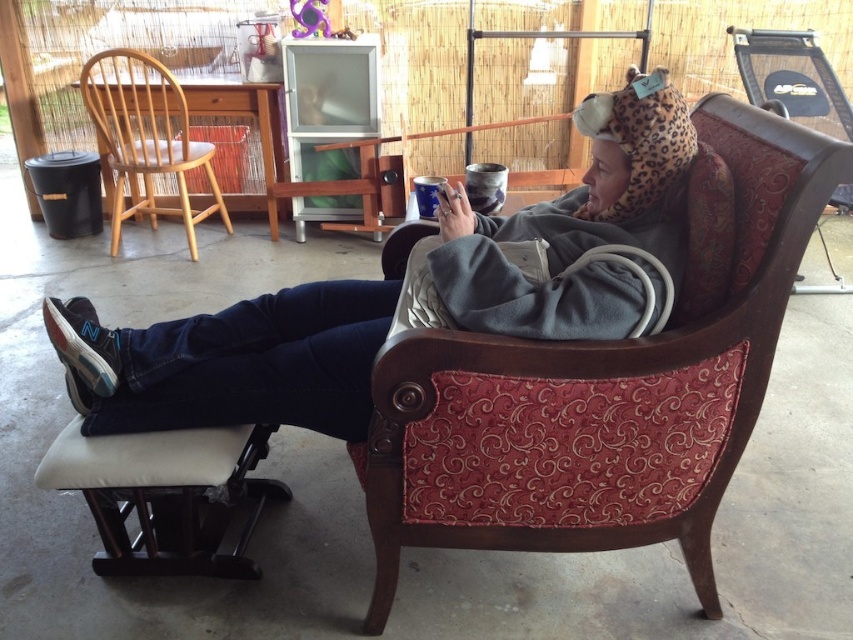
Does gray fleece blanket at upper right have a lesser width compared to light wood chair at left?

No, gray fleece blanket at upper right is not thinner than light wood chair at left.

Can you confirm if gray fleece blanket at upper right is positioned above light wood chair at left?

No.

Identify the location of gray fleece blanket at upper right. (230, 362).

Who is positioned more to the left, velvet-patterned armchair at center or gray fleece blanket at upper right?

gray fleece blanket at upper right is more to the left.

Which of these two, velvet-patterned armchair at center or gray fleece blanket at upper right, stands taller?

With more height is velvet-patterned armchair at center.

Describe the element at coordinates (602, 388) in the screenshot. I see `velvet-patterned armchair at center` at that location.

Locate an element on the screen. velvet-patterned armchair at center is located at coordinates (602, 388).

Does velvet-patterned armchair at center have a larger size compared to light wood chair at left?

Correct, velvet-patterned armchair at center is larger in size than light wood chair at left.

Is velvet-patterned armchair at center positioned behind light wood chair at left?

No.

Describe the element at coordinates (602, 388) in the screenshot. This screenshot has width=853, height=640. I see `velvet-patterned armchair at center` at that location.

This screenshot has height=640, width=853. Identify the location of velvet-patterned armchair at center. (602, 388).